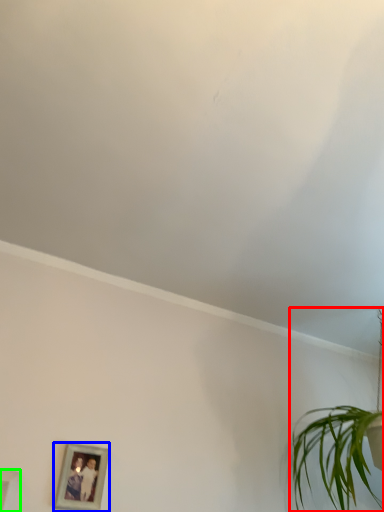
Question: Considering the real-world distances, which object is closest to houseplant (highlighted by a red box)? picture frame (highlighted by a blue box) or picture frame (highlighted by a green box).

Choices:
 (A) picture frame
 (B) picture frame

Answer: (A)